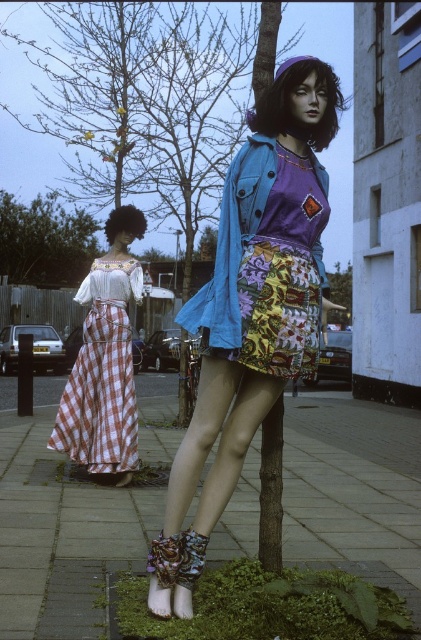
Is green textured tree at center above checkered fabric dress at left?

Yes, green textured tree at center is above checkered fabric dress at left.

Does green textured tree at center appear under checkered fabric dress at left?

Actually, green textured tree at center is above checkered fabric dress at left.

Is point (175, 144) positioned before point (93, 294)?

No.

At what (x,y) coordinates should I click in order to perform the action: click on green textured tree at center. Please return your answer as a coordinate pair (x, y). The width and height of the screenshot is (421, 640). Looking at the image, I should click on 141,108.

Does matte blue denim jacket at center have a larger size compared to checkered fabric dress at left?

Yes, matte blue denim jacket at center is bigger than checkered fabric dress at left.

Who is shorter, matte blue denim jacket at center or checkered fabric dress at left?

checkered fabric dress at left is shorter.

Where is `matte blue denim jacket at center`? The height and width of the screenshot is (640, 421). matte blue denim jacket at center is located at coordinates (250, 310).

Is point (322, 170) closer to camera compared to point (28, 276)?

Yes, point (322, 170) is in front of point (28, 276).

Which is above, denim jacket at center or green leafy tree at upper left?

Positioned higher is green leafy tree at upper left.

Consider the image. Who is more forward, (269, 156) or (31, 216)?

Positioned in front is point (269, 156).

Find the location of `denim jacket at center`. denim jacket at center is located at coordinates (232, 243).